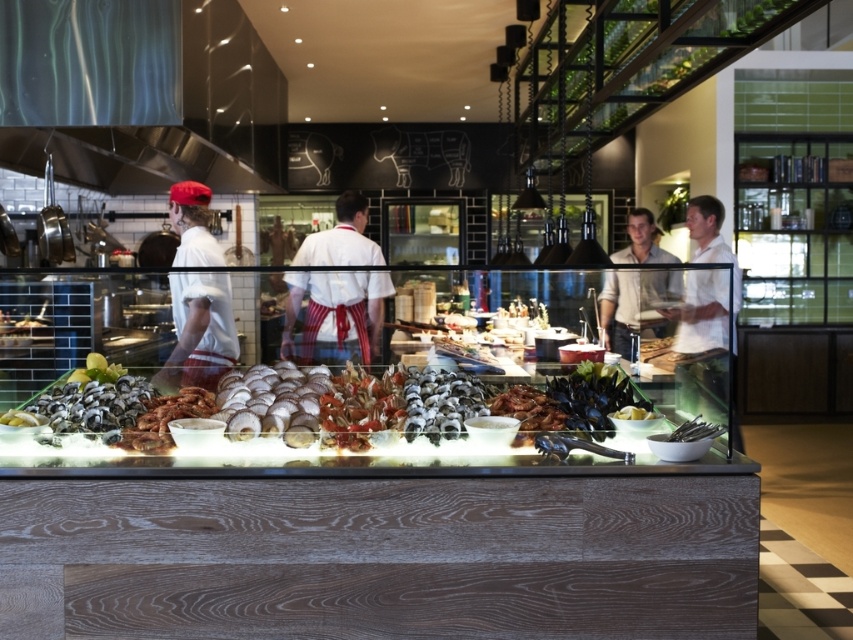
Is point (213, 310) behind point (668, 275)?

No, (213, 310) is closer to viewer.

Is point (184, 257) positioned before point (666, 269)?

Yes, point (184, 257) is in front of point (666, 269).

Where is `matte white shirt at left`? matte white shirt at left is located at coordinates (199, 332).

The width and height of the screenshot is (853, 640). Find the location of `matte white shirt at left`. matte white shirt at left is located at coordinates (199, 332).

Does shiny silver seafood at center lie in front of light beige shirt at center?

Yes.

Is shiny silver seafood at center behind light beige shirt at center?

No, it is in front of light beige shirt at center.

Between point (316, 403) and point (618, 301), which one is positioned behind?

The point (618, 301) is behind.

This screenshot has height=640, width=853. What are the coordinates of `shiny silver seafood at center` in the screenshot? It's located at (318, 406).

Is white striped apron at center in front of matte white shirt at left?

No, white striped apron at center is further to the viewer.

The height and width of the screenshot is (640, 853). What do you see at coordinates (335, 314) in the screenshot?
I see `white striped apron at center` at bounding box center [335, 314].

This screenshot has height=640, width=853. What are the coordinates of `white striped apron at center` in the screenshot? It's located at (335, 314).